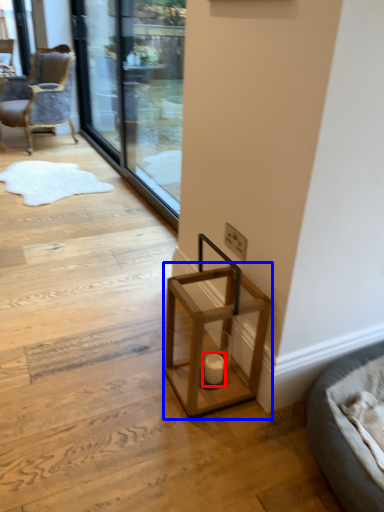
Question: Which point is closer to the camera, candle holder (highlighted by a red box) or table (highlighted by a blue box)?

Choices:
 (A) candle holder
 (B) table

Answer: (B)